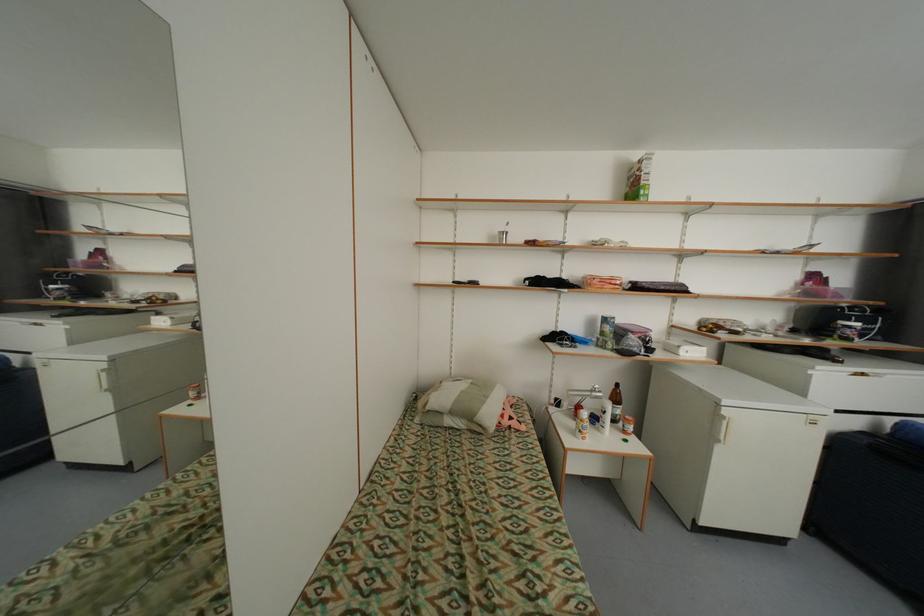
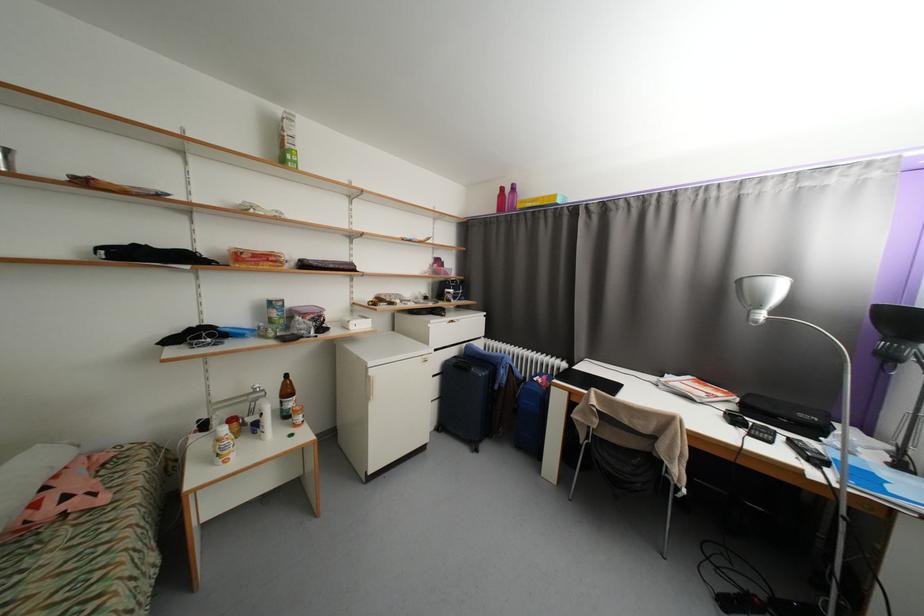
The point at (604, 431) is marked in the first image. Where is the corresponding point in the second image?

(265, 439)